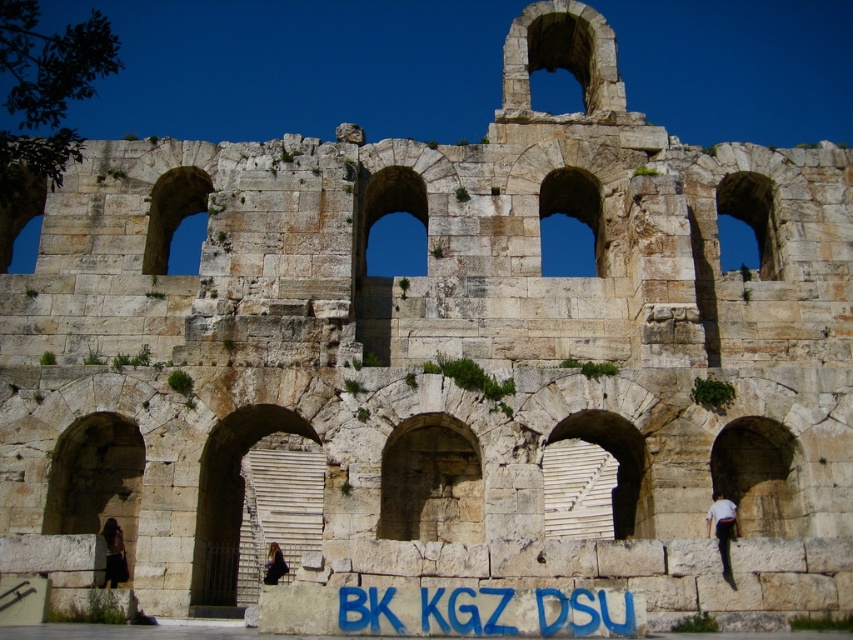
You are standing in front of the Odeon of Herodes Atticus in Athens. You notice two points marked in the image at coordinates point (x=495, y=588) and point (x=282, y=556). Which of these two points is physically closer to your current position?

Point (x=495, y=588) is closer to the viewer than point (x=282, y=556), so the point at (x=495, y=588) is physically closer to your current position.

You are a tour guide explaining the historical significance of the Odeon of Herodes Atticus to a group. You notice the blue paint graffiti at center and the dark brown leather jacket at lower left in the scene. Which object is closer to the visitors standing at the entrance?

The blue paint graffiti at center is closer to the visitors standing at the entrance because it is in front of the dark brown leather jacket at lower left.